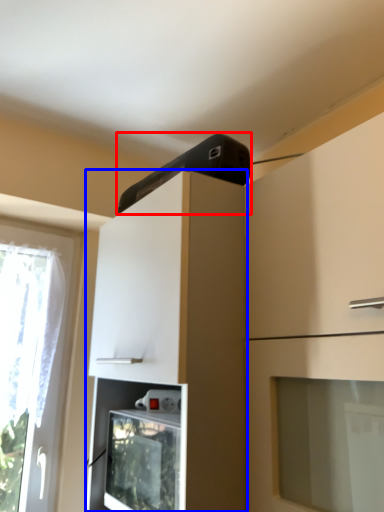
Question: Among these objects, which one is farthest to the camera, appliance (highlighted by a red box) or cabinetry (highlighted by a blue box)?

Choices:
 (A) appliance
 (B) cabinetry

Answer: (A)